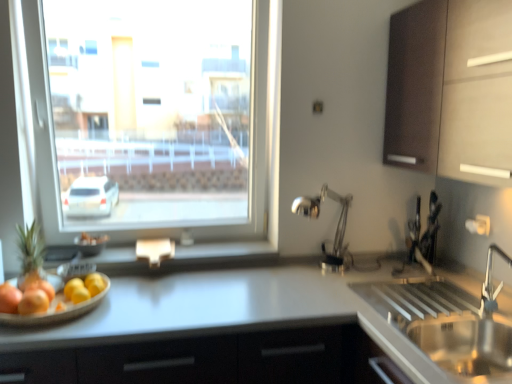
I want to click on unoccupied space behind yellow matte lemon at lower left, the 2th fruit positioned from the left, so click(x=122, y=290).